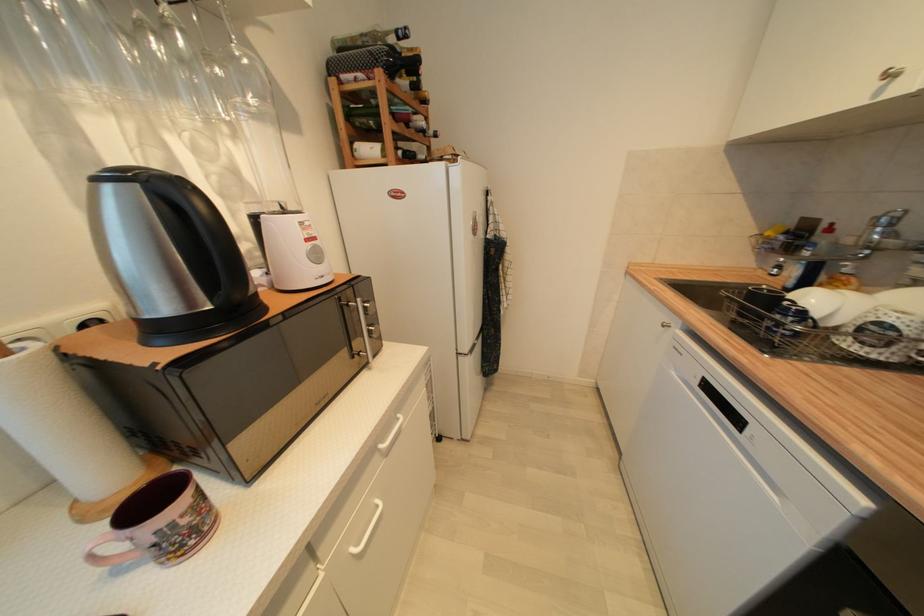
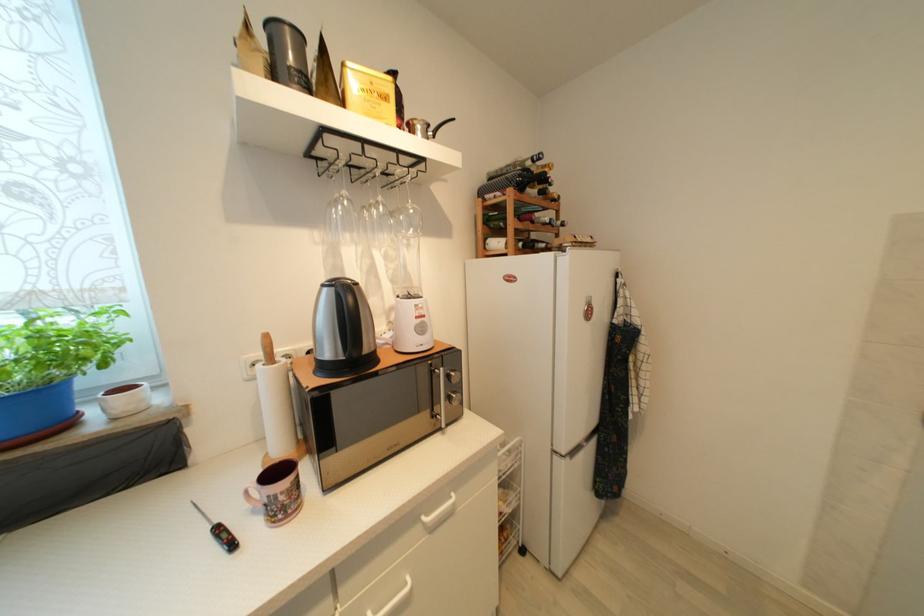
In the second image, find the point that corresponds to the point at 379,36 in the first image.

(518, 166)